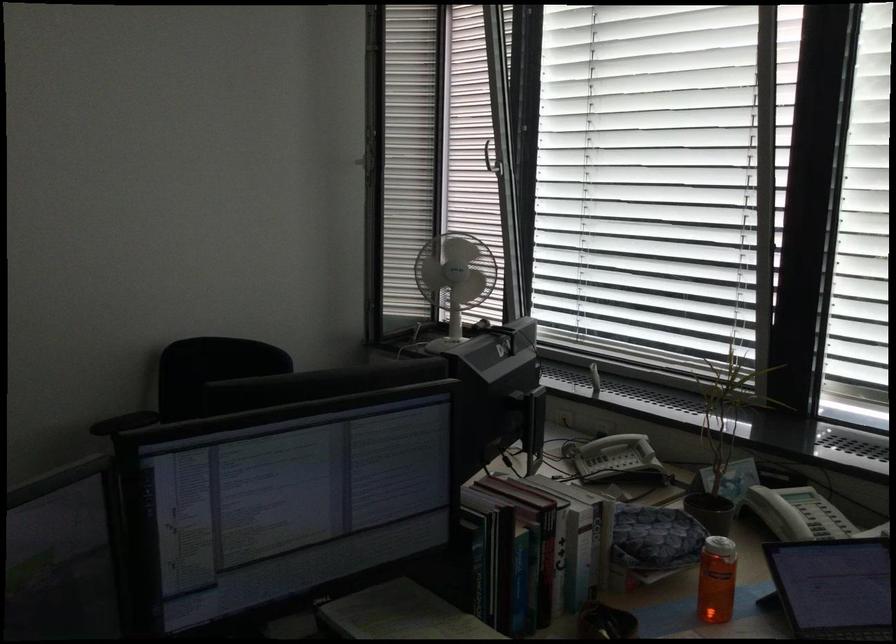
Find the location of a particular element. This screenshot has height=644, width=896. blue book is located at coordinates (497, 550).